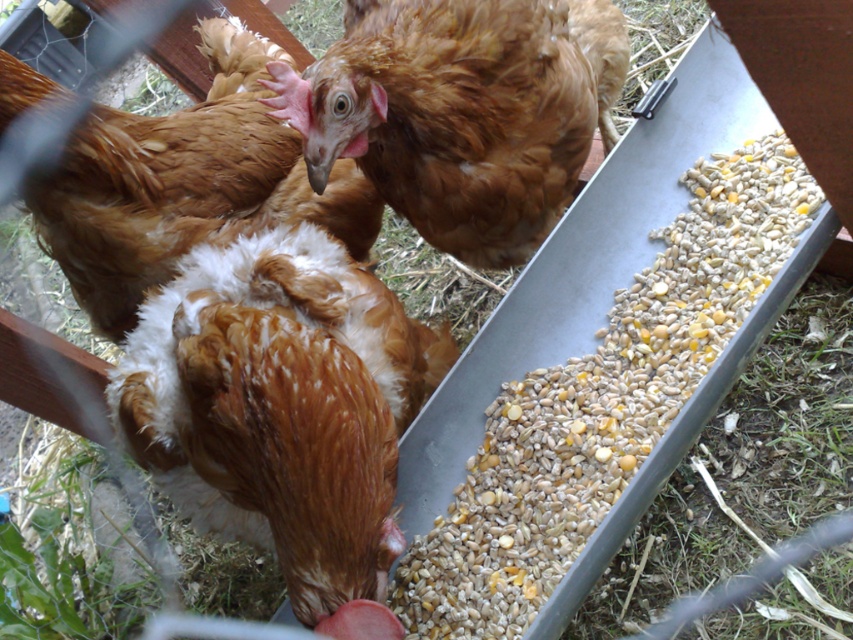
Question: Which of these objects is positioned farthest from the brown speckled feathers at center?

Choices:
 (A) brown feathered chicken at center
 (B) brown fluffy chicken at center

Answer: (A)

Question: Is brown speckled feathers at center to the right of brown feathered chicken at center from the viewer's perspective?

Choices:
 (A) yes
 (B) no

Answer: (B)

Question: Is brown speckled feathers at center below brown feathered chicken at center?

Choices:
 (A) no
 (B) yes

Answer: (B)

Question: Which point is closer to the camera?

Choices:
 (A) (461, 58)
 (B) (219, 289)
 (C) (91, 291)

Answer: (B)

Question: Does brown feathered chicken at center appear under brown fluffy chicken at center?

Choices:
 (A) no
 (B) yes

Answer: (B)

Question: Which of the following is the farthest from the observer?

Choices:
 (A) (589, 72)
 (B) (334, 588)

Answer: (A)